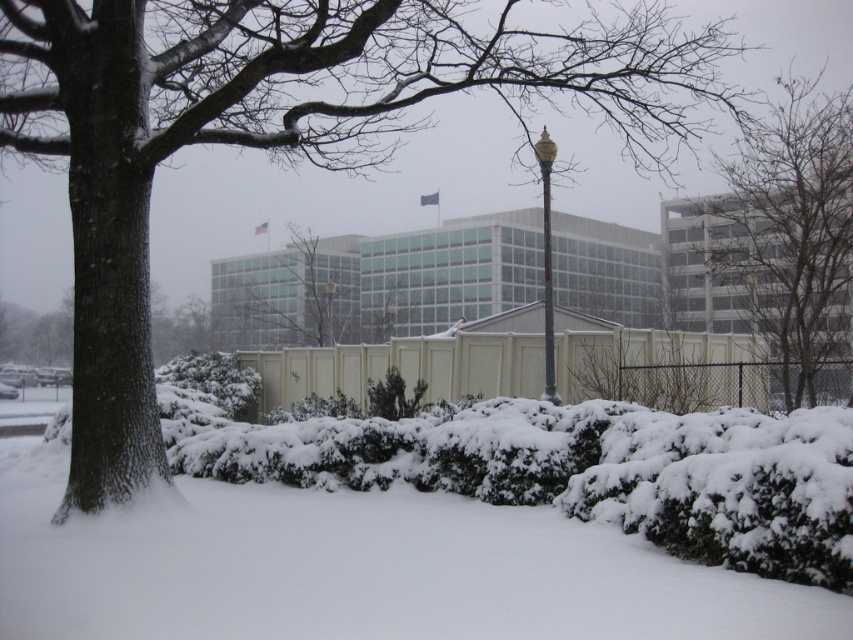
Looking at this image, between bare branches at center and gold polished lamp post at center, which one has more height?

bare branches at center

Who is higher up, bare branches at center or gold polished lamp post at center?

bare branches at center

Find the location of a particular element. bare branches at center is located at coordinates (791, 234).

Who is more forward, (x=689, y=132) or (x=544, y=284)?

Point (x=544, y=284) is in front.

Can you confirm if snow-covered tree at left is thinner than gold polished metal lamp post at upper center?

Incorrect, snow-covered tree at left's width is not less than gold polished metal lamp post at upper center's.

Is point (619, 29) positioned before point (544, 294)?

No, (619, 29) is behind (544, 294).

Where is `snow-covered tree at left`? The image size is (853, 640). snow-covered tree at left is located at coordinates (282, 132).

Does bare branches at center have a smaller size compared to gold polished metal lamp post at upper center?

Incorrect, bare branches at center is not smaller in size than gold polished metal lamp post at upper center.

Between point (784, 401) and point (553, 156), which one is positioned in front?

Positioned in front is point (784, 401).

Find the location of a particular element. The height and width of the screenshot is (640, 853). bare branches at center is located at coordinates (791, 234).